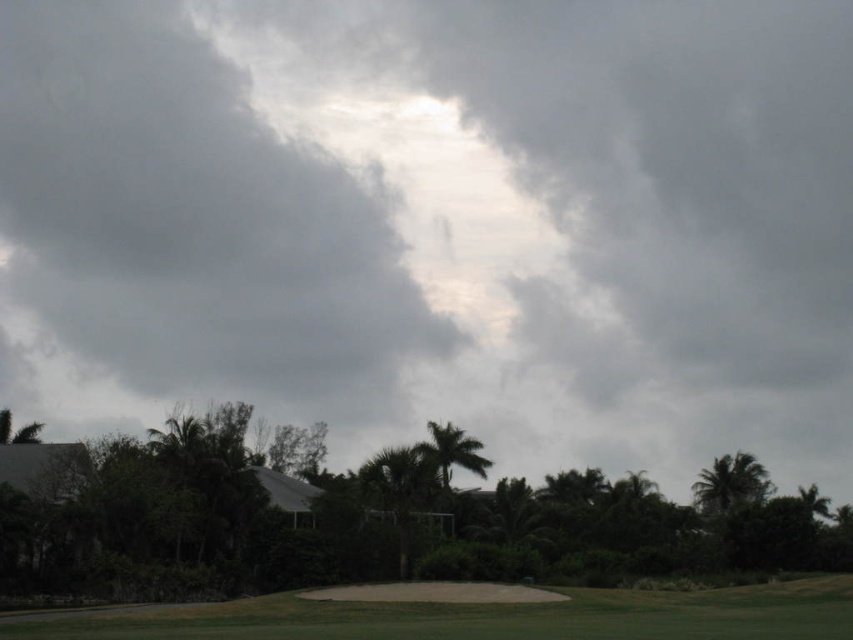
Between sandy brown sand trap at lower center and green leafy palm tree at center, which one has less height?

sandy brown sand trap at lower center

Which is more to the right, sandy brown sand trap at lower center or green leafy palm tree at center?

Positioned to the right is sandy brown sand trap at lower center.

Measure the distance between sandy brown sand trap at lower center and camera.

sandy brown sand trap at lower center is 79.89 feet away from camera.

The image size is (853, 640). In order to click on sandy brown sand trap at lower center in this screenshot , I will do `click(483, 616)`.

Can you confirm if green leafy tree at center is positioned to the left of green leafy palm tree at center?

Yes, green leafy tree at center is to the left of green leafy palm tree at center.

Does green leafy tree at center have a larger size compared to green leafy palm tree at center?

Yes.

Is point (639, 493) closer to camera compared to point (440, 460)?

No, it is not.

Identify the location of green leafy tree at center. The image size is (853, 640). (357, 522).

Consider the image. Between green leafy tree at center and green leafy palm tree at upper right, which one has less height?

Standing shorter between the two is green leafy palm tree at upper right.

Describe the element at coordinates (357, 522) in the screenshot. I see `green leafy tree at center` at that location.

The width and height of the screenshot is (853, 640). I want to click on green leafy tree at center, so click(357, 522).